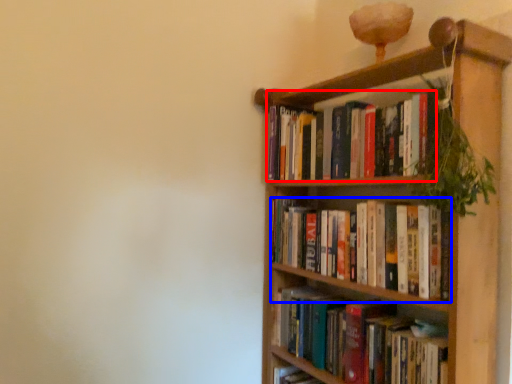
Question: Among these objects, which one is nearest to the camera, book (highlighted by a red box) or book (highlighted by a blue box)?

Choices:
 (A) book
 (B) book

Answer: (B)